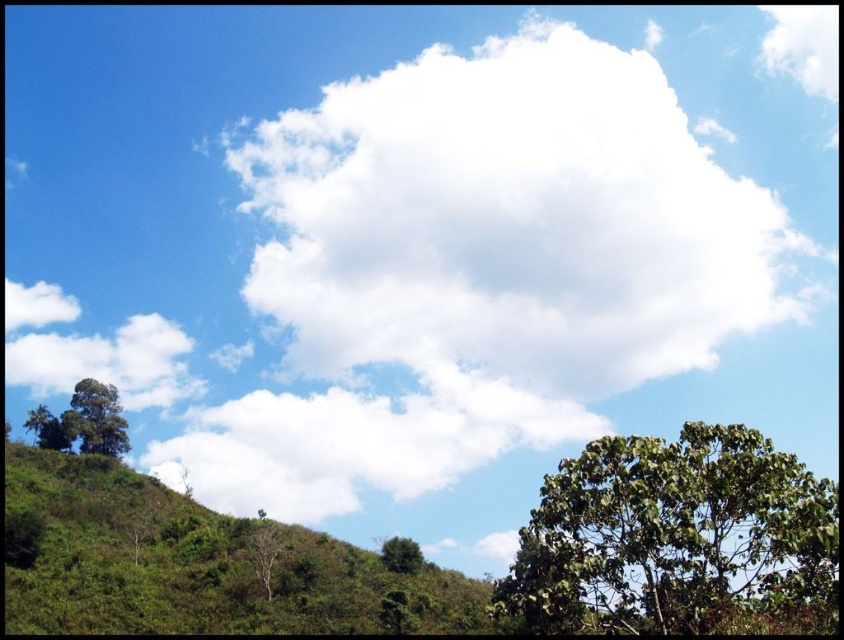
Based on the photo, you are standing in the landscape and want to take a photo. There are two points marked in the image, point 1 at coordinates point 1 at point (123, 445) and point 2 at point (410, 564). Which point is closer to your camera?

Point 1 at point (123, 445) is closer to the camera because it is further to the camera than point 2 at point (410, 564).

You are planning to plant a new tree in your garden. You have two options based on the image provided. The green matte tree at lower left and the green leafy tree at center. Which tree should you choose if you want a larger tree for shade?

The green matte tree at lower left is bigger than the green leafy tree at center, so you should choose the green matte tree at lower left for a larger tree that provides more shade.

You are an airplane pilot flying at an altitude of 10,000 feet. You notice two clouds in the sky ahead of you. The first is the white fluffy cloud at upper center and the second is the white fluffy cloud at center. Which cloud is higher in the sky?

The white fluffy cloud at upper center is higher in the sky because it is much taller than the white fluffy cloud at center.